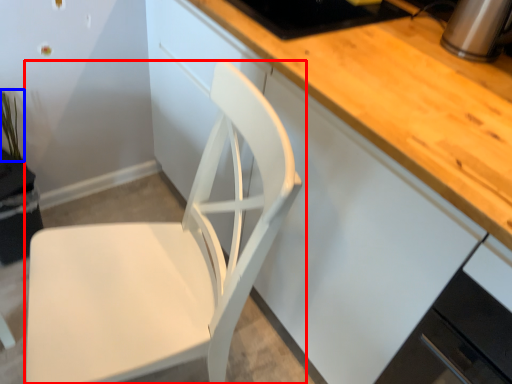
Question: Which point is closer to the camera, chair (highlighted by a red box) or plant (highlighted by a blue box)?

Choices:
 (A) chair
 (B) plant

Answer: (A)